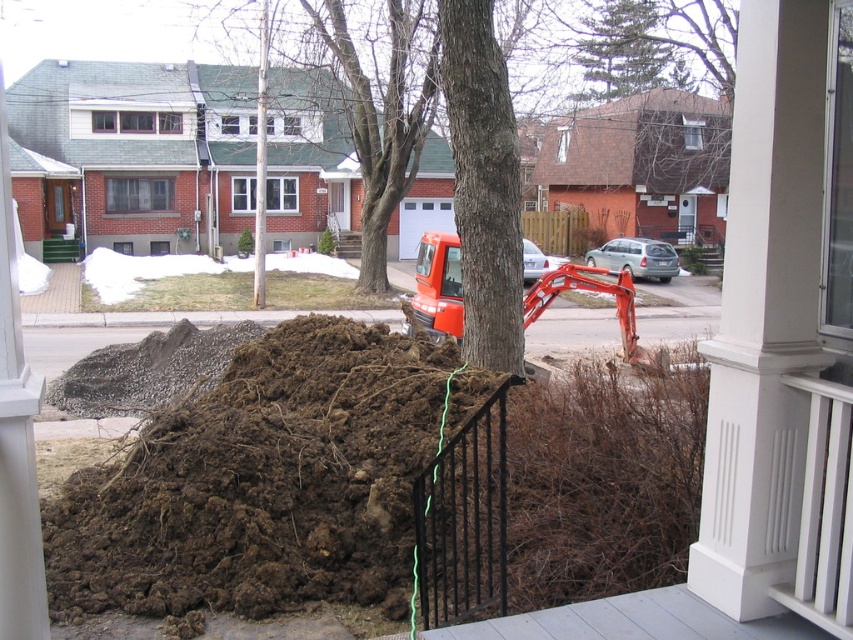
You are a delivery person trying to navigate a small cart through the residential street scene. You need to pass between the black metal fence at lower center and the orange rubber excavator at center. Can your cart fit through the space between them?

The black metal fence at lower center is thinner than the orange rubber excavator at center, so the space between them may be narrow. However, without knowing the exact width of the cart or the distance between the two objects, it is impossible to determine if the cart can fit through the space. Additional measurements are needed to confirm.

You are a delivery person with a cart that is 2 meters wide. You need to navigate around the black metal fence at lower center and the orange rubber excavator at center to reach the driveway. Can your cart fit through the space between them?

The black metal fence at lower center and orange rubber excavator at center are 5.04 meters apart. Since your cart is 2 meters wide, there is sufficient space to pass through the 5.04 meter gap between them.